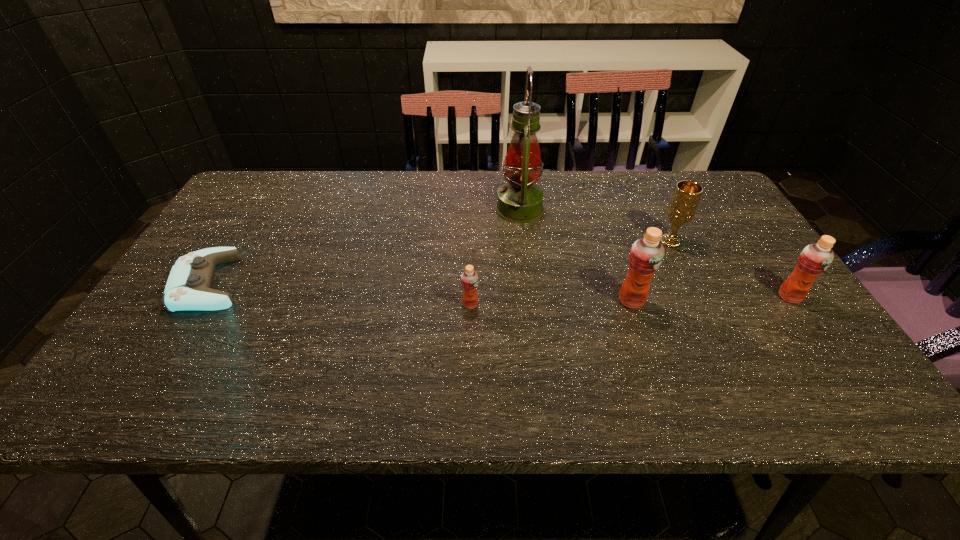
Given the evenly spaced orange juices in the image, where should an extra orange juice be added on the left to preserve the spacing? Please point to a vacant space. Please provide its 2D coordinates. Your answer should be formatted as a tuple, i.e. [(x, y)], where the tuple contains the x and y coordinates of a point satisfying the conditions above.

[(306, 308)]